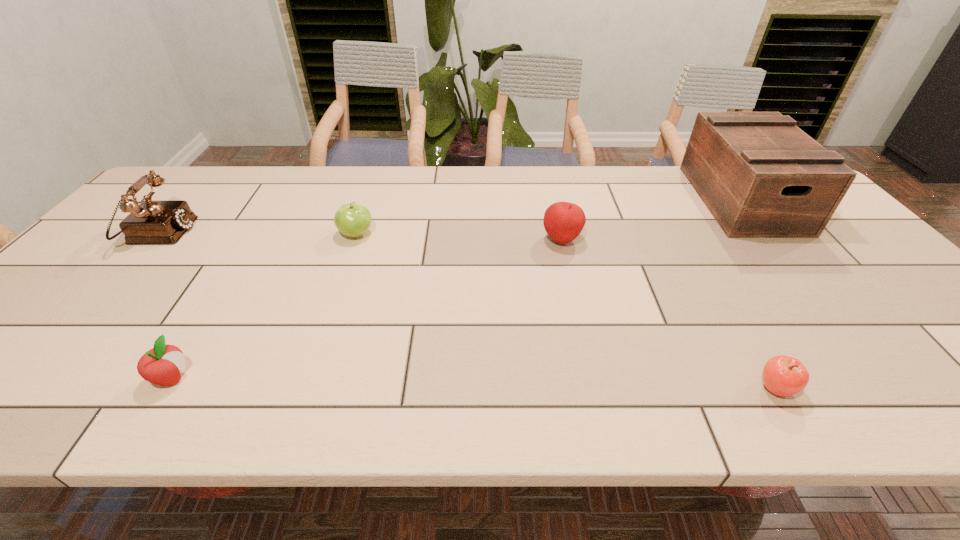
I want to click on the rightmost object, so click(760, 176).

The image size is (960, 540). What are the coordinates of `box` in the screenshot? It's located at (760, 176).

Identify the location of telephone. The height and width of the screenshot is (540, 960). (152, 222).

This screenshot has height=540, width=960. Identify the location of the leftmost object. (152, 222).

At what (x,y) coordinates should I click in order to perform the action: click on the third object from right to left. Please return your answer as a coordinate pair (x, y). Image resolution: width=960 pixels, height=540 pixels. Looking at the image, I should click on (563, 221).

I want to click on the fourth object from right to left, so click(352, 219).

This screenshot has height=540, width=960. Find the location of `the leftmost apple`. the leftmost apple is located at coordinates (162, 365).

This screenshot has height=540, width=960. Identify the location of the rightmost apple. (782, 375).

Where is `vacant area situated 0.220m on the left of the rightmost object`? Image resolution: width=960 pixels, height=540 pixels. vacant area situated 0.220m on the left of the rightmost object is located at coordinates (632, 199).

This screenshot has height=540, width=960. I want to click on vacant space located 0.190m on the dial of the second tallest object, so click(x=257, y=233).